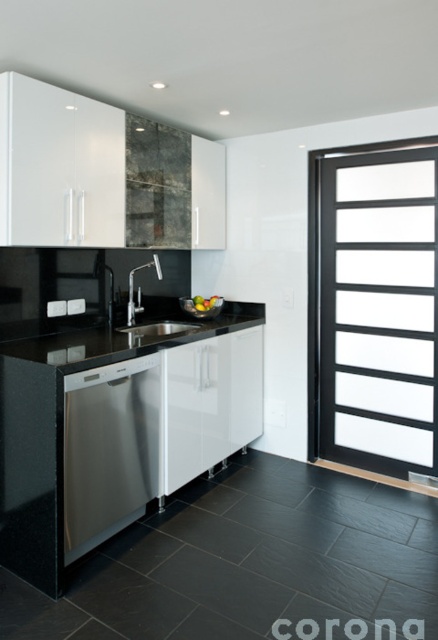
Question: Can you confirm if transparent matte glass door at right is positioned below black granite countertop at center?

Choices:
 (A) yes
 (B) no

Answer: (B)

Question: Is transparent matte glass door at right below satin stainless steel sink at center?

Choices:
 (A) yes
 (B) no

Answer: (B)

Question: Among these points, which one is nearest to the camera?

Choices:
 (A) (339, 298)
 (B) (133, 300)
 (C) (74, 356)
 (D) (140, 330)

Answer: (C)

Question: Which object is closer to the camera taking this photo?

Choices:
 (A) satin stainless steel sink at center
 (B) transparent matte glass door at right
 (C) black granite countertop at center
 (D) stainless steel dishwasher at lower left

Answer: (C)

Question: Is stainless steel dishwasher at lower left bigger than satin stainless steel sink at center?

Choices:
 (A) yes
 (B) no

Answer: (A)

Question: Among these objects, which one is farthest from the camera?

Choices:
 (A) black granite countertop at center
 (B) satin stainless steel sink at center
 (C) stainless steel dishwasher at lower left

Answer: (B)